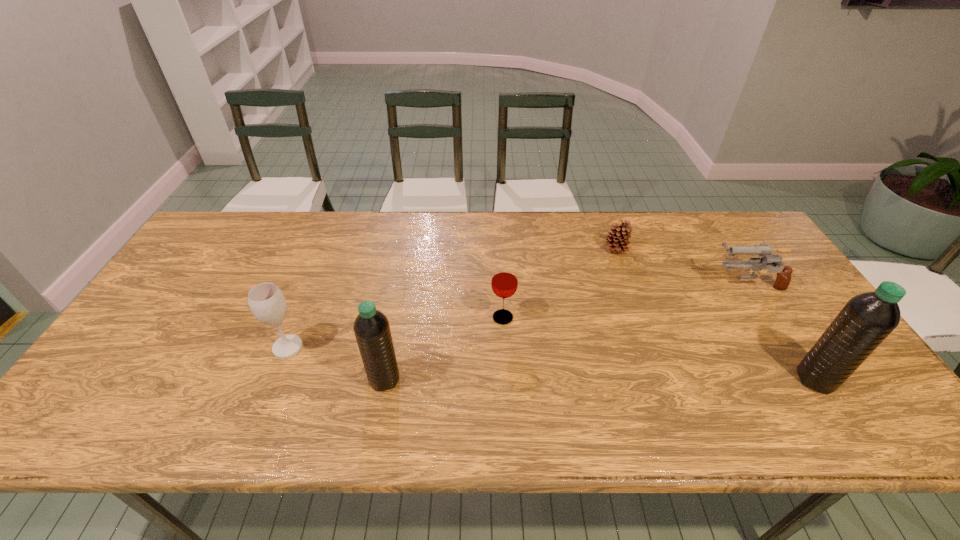
Locate an element on the screen. This screenshot has height=540, width=960. object located in the far edge section of the desktop is located at coordinates (617, 240).

Find the location of a particular element. water bottle that is at the right edge is located at coordinates (867, 319).

Identify the location of gun that is at the right edge. (783, 278).

Locate an element on the screen. object that is at the near right corner is located at coordinates (867, 319).

The image size is (960, 540). In the image, there is a desktop. In order to click on vacant space at the far edge in this screenshot , I will do `click(500, 252)`.

This screenshot has height=540, width=960. In the image, there is a desktop. In order to click on vacant region at the near edge in this screenshot , I will do `click(430, 384)`.

Where is `free space at the far left corner`? This screenshot has width=960, height=540. free space at the far left corner is located at coordinates (252, 227).

At what (x,y) coordinates should I click in order to perform the action: click on free space at the far right corner. Please return your answer as a coordinate pair (x, y). Looking at the image, I should click on (734, 221).

Where is `vacant space that's between the third farthest object and the wineglass`? vacant space that's between the third farthest object and the wineglass is located at coordinates (396, 333).

Where is `vacant area that lies between the second shortest object and the fifth shortest object`? Image resolution: width=960 pixels, height=540 pixels. vacant area that lies between the second shortest object and the fifth shortest object is located at coordinates (565, 331).